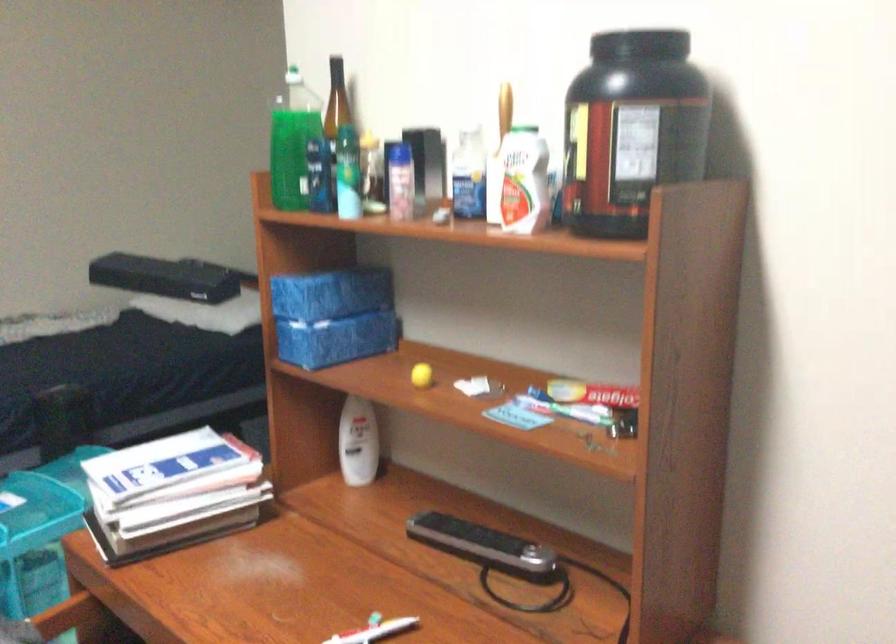
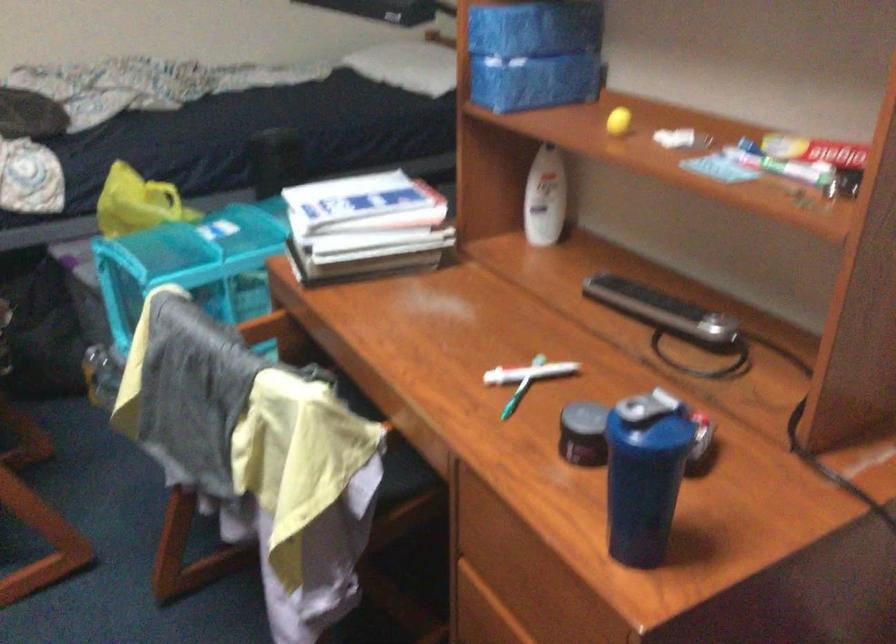
In the second image, find the point that corresponds to point (336, 290) in the first image.

(536, 26)